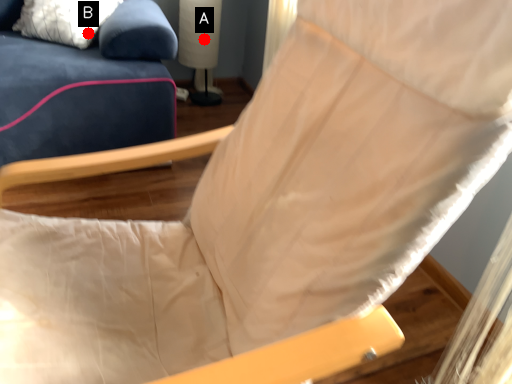
Question: Two points are circled on the image, labeled by A and B beside each circle. Which point appears farthest from the camera in this image?

Choices:
 (A) A is further
 (B) B is further

Answer: (A)